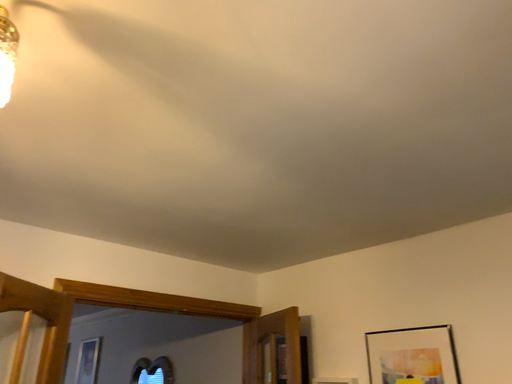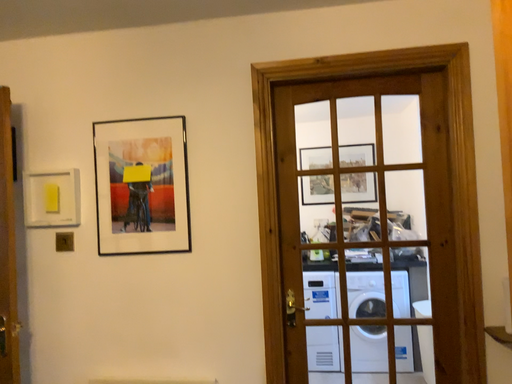
Question: How did the camera likely rotate when shooting the video?

Choices:
 (A) rotated upward
 (B) rotated downward

Answer: (B)